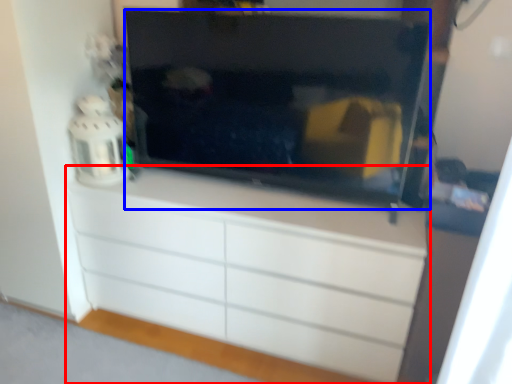
Question: Among these objects, which one is nearest to the camera, chest of drawers (highlighted by a red box) or television (highlighted by a blue box)?

Choices:
 (A) chest of drawers
 (B) television

Answer: (B)